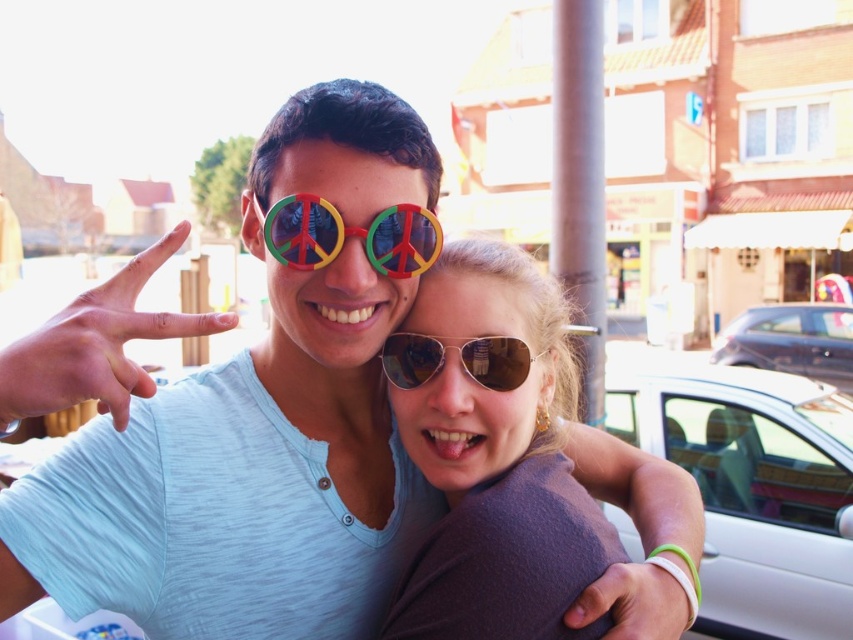
Question: Can you confirm if multicolored plastic goggles at center is positioned above white rubber bracelet at lower right?

Choices:
 (A) no
 (B) yes

Answer: (B)

Question: Which point is closer to the camera?

Choices:
 (A) (483, 355)
 (B) (347, 228)
 (C) (814, 310)
 (D) (653, 612)

Answer: (D)

Question: Which object appears closest to the camera in this image?

Choices:
 (A) matte plastic hand at center
 (B) white rubber bracelet at lower right

Answer: (A)

Question: Which object is the closest to the matte plastic hand at center?

Choices:
 (A) metallic blue car at right
 (B) sunglasses at center
 (C) white matte car at right

Answer: (B)

Question: Does matte plastic sunglasses at center appear on the left side of multicolored plastic goggles at center?

Choices:
 (A) yes
 (B) no

Answer: (A)

Question: Does multicolored plastic goggles at center have a greater width compared to white rubber bracelet at lower right?

Choices:
 (A) no
 (B) yes

Answer: (B)